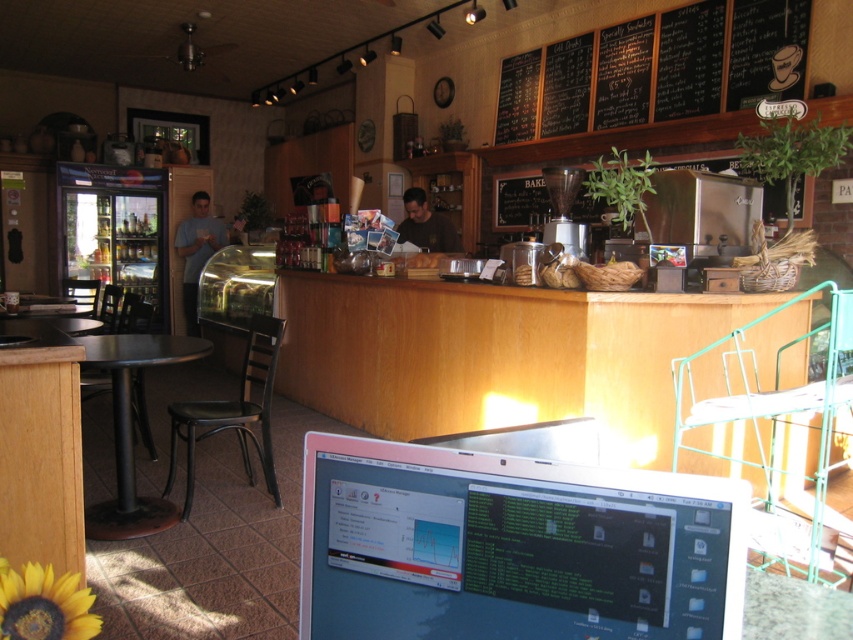
You are a customer standing at the counter in the cozy cafe. You notice the satin silver laptop at lower center and the black chalkboard menu at upper center. Which object is shorter in height?

The satin silver laptop at lower center is shorter than the black chalkboard menu at upper center.

Looking at this image, you are a customer at the cozy cafe and want to check your email on your satin silver laptop at lower center. The cafe has a charging station 1 meter away from your current position. Can you reach the charging station without moving your laptop?

The satin silver laptop at lower center is 65.81 centimeters from camera. Since the charging station is 1 meter away, which is longer than the distance of the laptop, you can reach the charging station without moving the laptop.